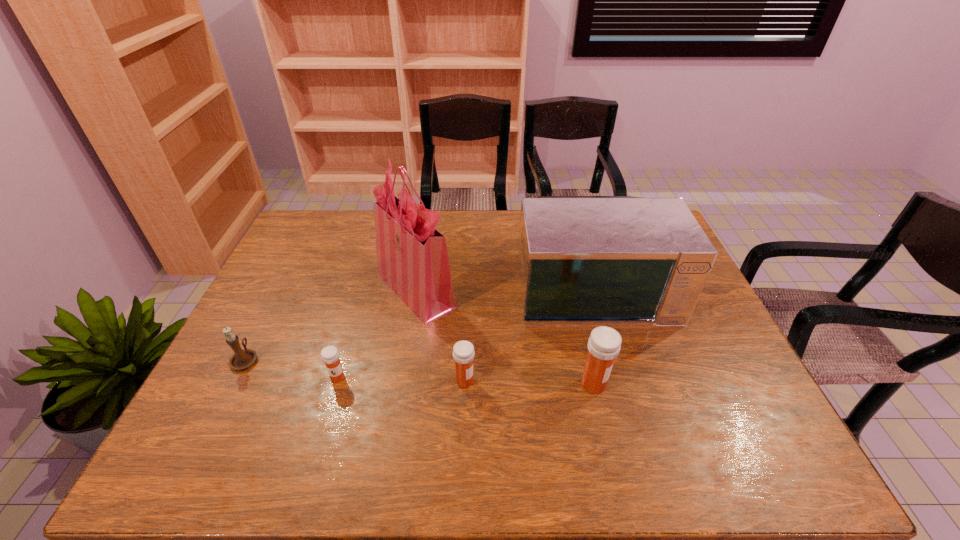
With all medicines evenly spaced, where should an extra medicine be placed on the right to continue the pattern? Please point out a vacant space. Please provide its 2D coordinates. Your answer should be formatted as a tuple, i.e. [(x, y)], where the tuple contains the x and y coordinates of a point satisfying the conditions above.

[(725, 388)]